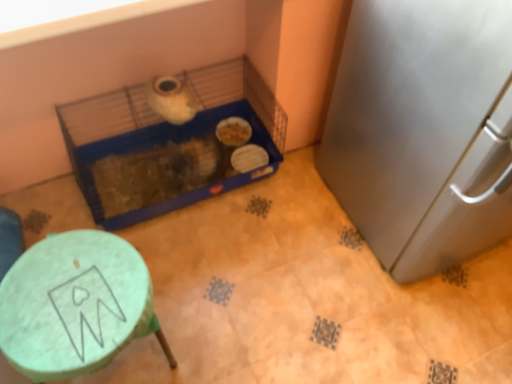
At what (x,y) coordinates should I click in order to perform the action: click on vacant space in between blue plastic bird cage at center and green matte stool at lower left. Please return your answer as a coordinate pair (x, y). Looking at the image, I should click on (195, 260).